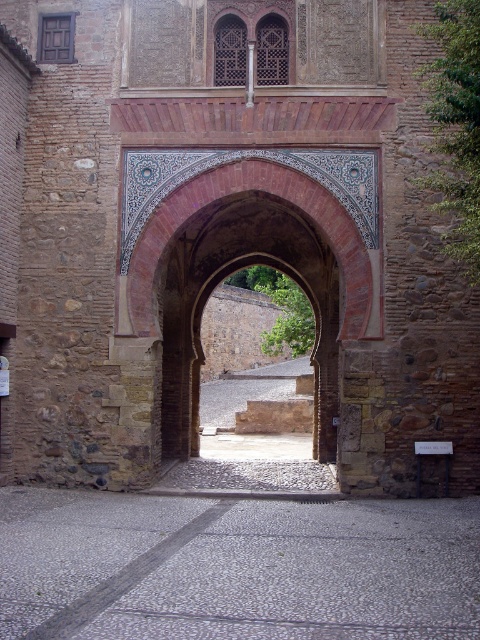
You are standing in front of the traditional archway and want to know how far the point at coordinates (111, 540) is from you. Can you determine the distance?

The point at coordinates (111, 540) is 18.58 meters away from the viewer.

You are standing in front of the archway and want to locate the gray stone courtyard at center. What are the coordinates where you can find it?

The gray stone courtyard at center is located at coordinates point [238,566].

You are standing in a historical site and see the gray stone courtyard at center and the terracotta brick archway at center. Which object is positioned to the left of the other?

The gray stone courtyard at center is to the left of terracotta brick archway at center.